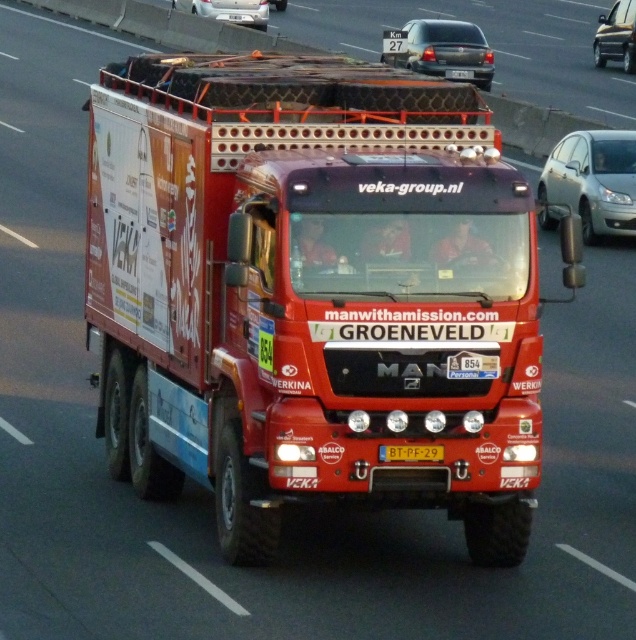
Consider the image. You are a photographer positioned at the starting line of a rally event. You need to capture both the shiny red truck at center and the matte black sedan at upper center in a single frame. Which vehicle should you position closer to the camera to ensure both are fully visible without cropping?

To ensure both the shiny red truck at center and the matte black sedan at upper center are fully visible in the frame, position the matte black sedan at upper center closer to the camera. Since the shiny red truck at center is shorter in height than the matte black sedan at upper center, angling the camera slightly downward while keeping the taller sedan closer will help include both vehicles without cropping.

In the scene shown: You are a drone operator trying to capture aerial footage of the shiny red truck at center and the matte black sedan at upper center. The drone has a maximum range of 20 meters. Can the drone capture both vehicles in a single shot without moving closer than 5 meters to either vehicle?

The distance between the shiny red truck at center and the matte black sedan at upper center is 21.08 meters. To maintain a minimum distance of 5 meters from each vehicle, the drone would need to stay at least 5 meters away from both. However, the total required distance would be the distance between the two vehicles plus twice the minimum distance from each vehicle. This results in 21.08 meters plus 5 meters plus 5 meters equals 31.08 meters. Since the drone can only reach 20 meters, it cannot capture both